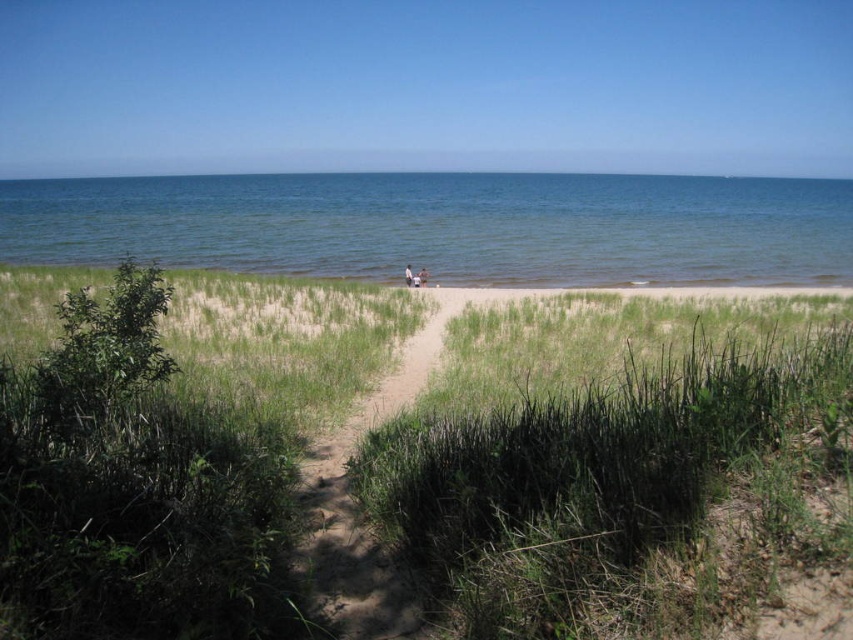
Question: Can you confirm if dirt path at center is positioned above light brown wooden bench at center?

Choices:
 (A) yes
 (B) no

Answer: (B)

Question: Does green grassy beach at center have a greater width compared to light brown wooden bench at center?

Choices:
 (A) no
 (B) yes

Answer: (B)

Question: Considering the real-world distances, which object is farthest from the green grassy beach at center?

Choices:
 (A) blue water at center
 (B) light brown wooden bench at center
 (C) light brown wooden stick at center
 (D) dirt path at center

Answer: (A)

Question: Among these points, which one is farthest from the camera?

Choices:
 (A) (405, 272)
 (B) (312, 355)

Answer: (A)

Question: Which object appears closest to the camera in this image?

Choices:
 (A) green grassy beach at center
 (B) light brown sand at center
 (C) blue water at center

Answer: (A)

Question: Can you confirm if dirt path at center is positioned above light brown wooden stick at center?

Choices:
 (A) no
 (B) yes

Answer: (A)